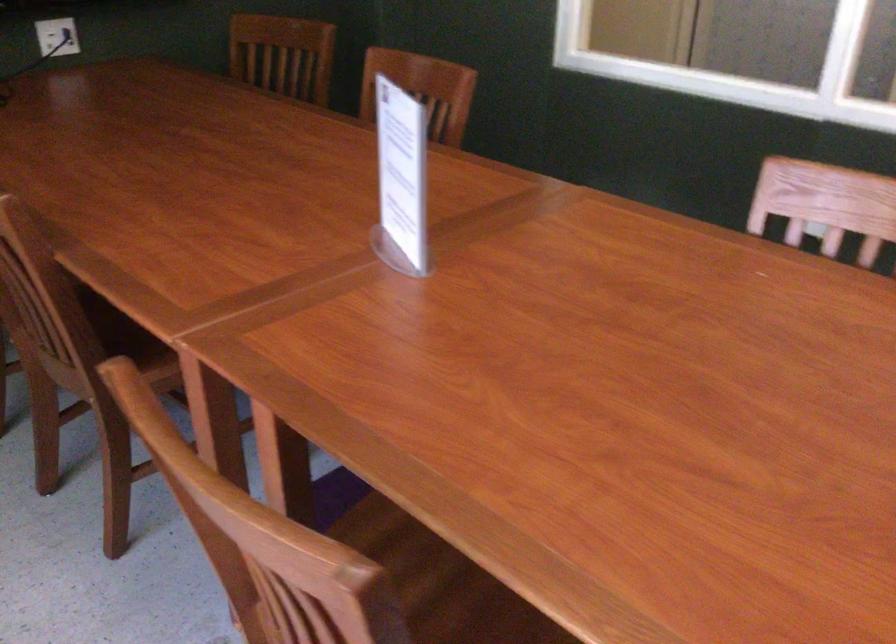
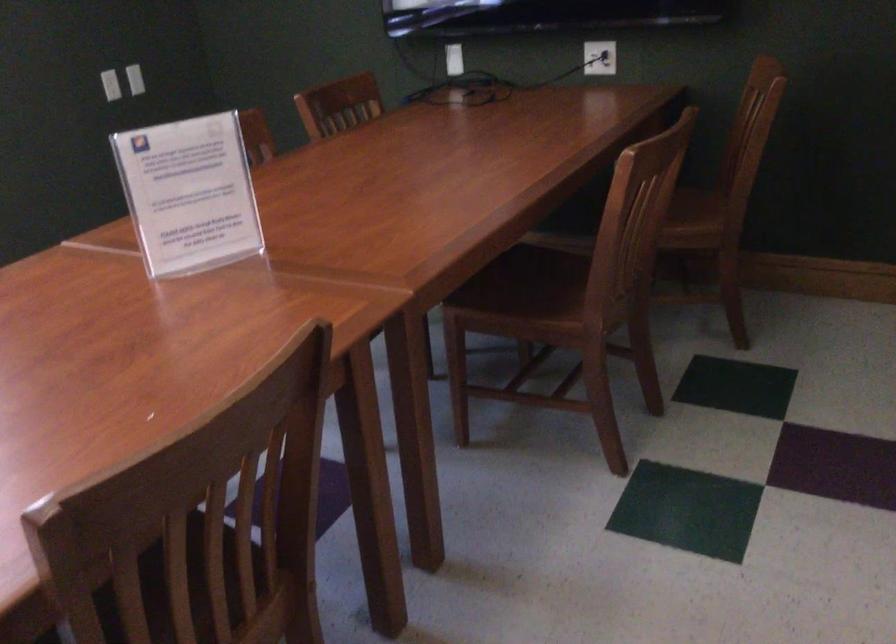
In the second image, find the point that corresponds to [383,173] in the first image.

(188, 194)